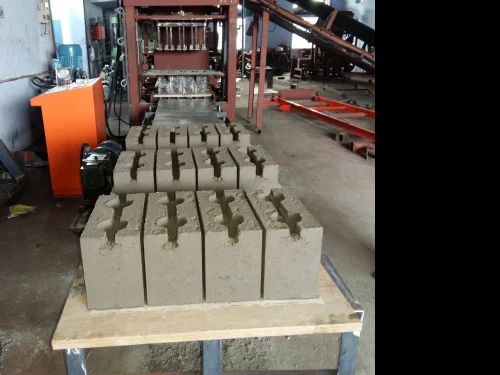
In order to click on the right table leg in this screenshot , I will do `click(348, 349)`.